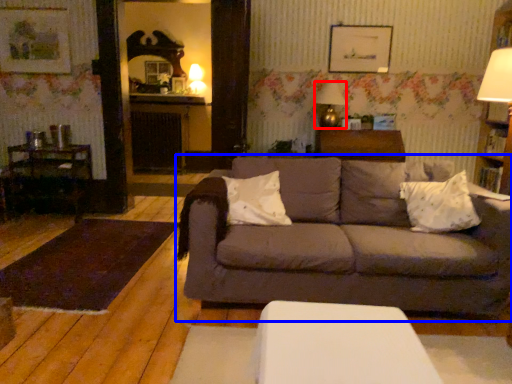
Question: Which object appears farthest to the camera in this image, table lamp (highlighted by a red box) or studio couch (highlighted by a blue box)?

Choices:
 (A) table lamp
 (B) studio couch

Answer: (A)